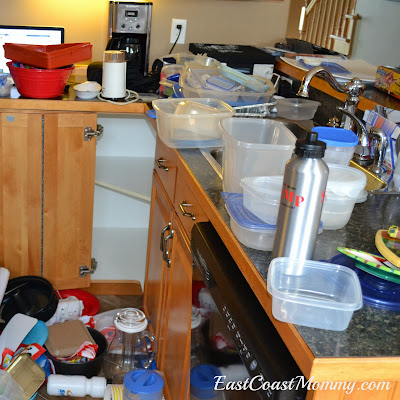
You are a GUI agent. You are given a task and a screenshot of the screen. Output one action in this format:
    pyautogui.click(x=<x>, y=<y>)
    Task: Click on the sink
    
    Given the screenshot: What is the action you would take?
    pyautogui.click(x=350, y=87)